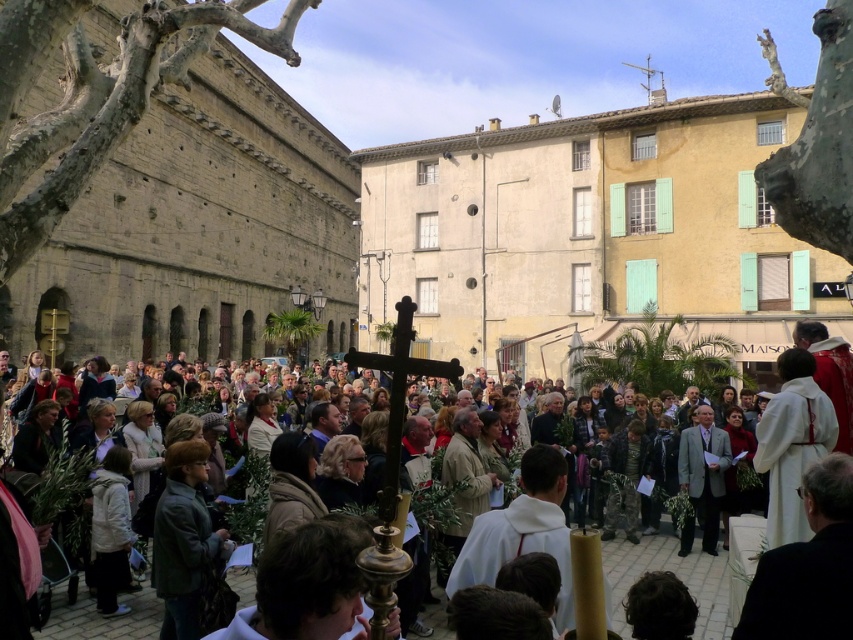
Question: Based on their relative distances, which object is farther from the gray wool suit at center?

Choices:
 (A) black matte robe at lower right
 (B) white cloth robe at lower right
 (C) gray stone church at left

Answer: (C)

Question: From the image, what is the correct spatial relationship of black matte robe at lower right in relation to dark green leather jacket at lower left?

Choices:
 (A) below
 (B) above

Answer: (B)

Question: Does black matte robe at lower right come behind dark green leather jacket at lower left?

Choices:
 (A) yes
 (B) no

Answer: (B)

Question: Which point is closer to the camera taking this photo?

Choices:
 (A) (831, 541)
 (B) (447, 636)

Answer: (A)

Question: Among these points, which one is farthest from the camera?

Choices:
 (A) (682, 552)
 (B) (170, 548)

Answer: (A)

Question: Can you confirm if gray stone church at left is positioned above smooth wooden cross at center?

Choices:
 (A) yes
 (B) no

Answer: (A)